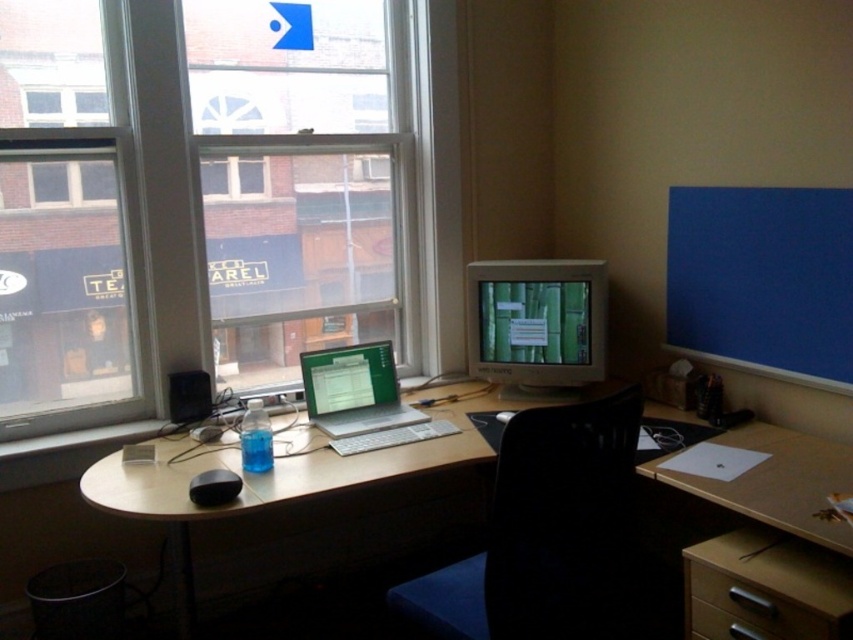
Question: Can you confirm if matte gray monitor at center is positioned below satin silver laptop at center?

Choices:
 (A) no
 (B) yes

Answer: (A)

Question: Is black plastic chair at center to the right of wooden drawer at lower right from the viewer's perspective?

Choices:
 (A) yes
 (B) no

Answer: (B)

Question: Can you confirm if transparent glass window at upper left is positioned to the right of satin silver laptop at center?

Choices:
 (A) yes
 (B) no

Answer: (B)

Question: Which point is farther from the camera taking this photo?

Choices:
 (A) (496, 352)
 (B) (357, 394)
 (C) (438, 630)
 (D) (135, 419)

Answer: (A)

Question: Which point is closer to the camera taking this photo?

Choices:
 (A) (486, 269)
 (B) (595, 429)

Answer: (B)

Question: Which point is farther to the camera?

Choices:
 (A) black plastic chair at center
 (B) light brown wooden desk at center
 (C) transparent glass window at upper left

Answer: (C)